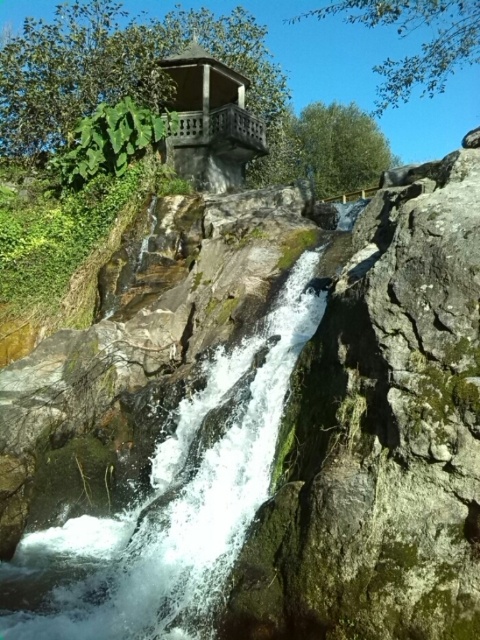
Measure the distance from white frothy water at center to wooden gazebo at upper center.

The distance of white frothy water at center from wooden gazebo at upper center is 13.86 meters.

From the picture: Can you confirm if white frothy water at center is wider than wooden gazebo at upper center?

No.

Is point (189, 472) more distant than point (241, 164)?

No, (189, 472) is in front of (241, 164).

I want to click on white frothy water at center, so click(x=168, y=504).